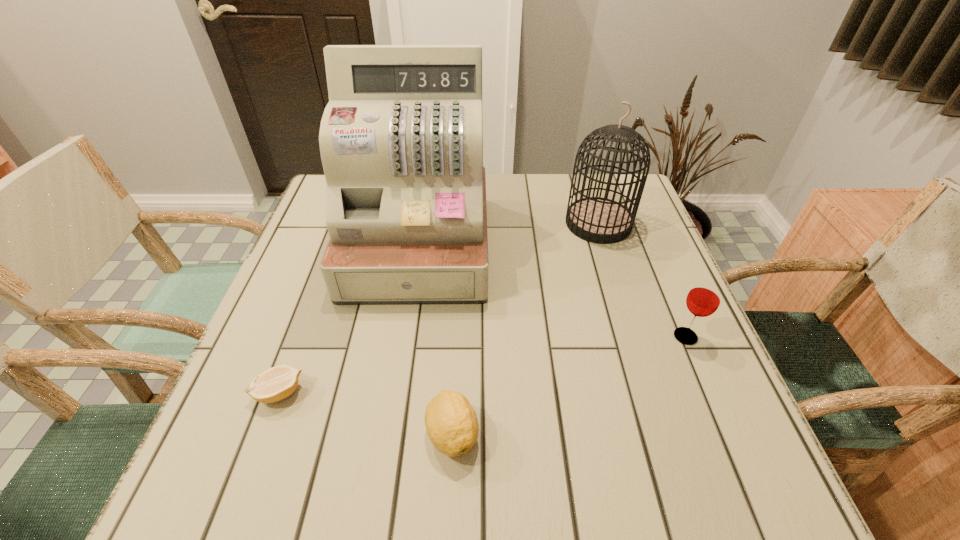
I want to click on object that is at the far right corner, so click(x=599, y=220).

The image size is (960, 540). Find the location of `free space at the far edge of the desktop`. free space at the far edge of the desktop is located at coordinates (535, 181).

Where is `free location at the near edge of the desktop`? free location at the near edge of the desktop is located at coordinates (480, 495).

The height and width of the screenshot is (540, 960). I want to click on vacant area at the left edge of the desktop, so click(x=315, y=403).

What are the coordinates of `free space at the right edge` in the screenshot? It's located at (648, 416).

In the image, there is a desktop. Where is `vacant space at the near left corner`? vacant space at the near left corner is located at coordinates tap(184, 502).

Image resolution: width=960 pixels, height=540 pixels. In order to click on vacant space at the near right corner in this screenshot , I will do `click(692, 457)`.

At what (x,y) coordinates should I click in order to perform the action: click on unoccupied position between the third shortest object and the left lemon. Please return your answer as a coordinate pair (x, y). The height and width of the screenshot is (540, 960). Looking at the image, I should click on [x=483, y=364].

Image resolution: width=960 pixels, height=540 pixels. In order to click on empty location between the fourth tallest object and the glass in this screenshot , I will do `click(569, 385)`.

Find the location of a particular element. This screenshot has width=960, height=540. vacant area that lies between the right lemon and the shortest object is located at coordinates (366, 413).